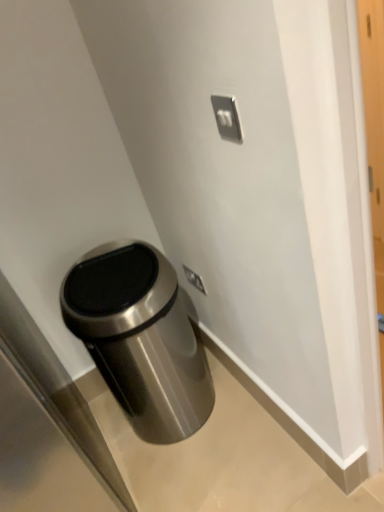
Describe the element at coordinates (140, 339) in the screenshot. I see `polished stainless steel trash can at lower left` at that location.

Where is `polished stainless steel trash can at lower left`? polished stainless steel trash can at lower left is located at coordinates (140, 339).

Locate an element on the screen. Image resolution: width=384 pixels, height=512 pixels. polished stainless steel trash can at lower left is located at coordinates (140, 339).